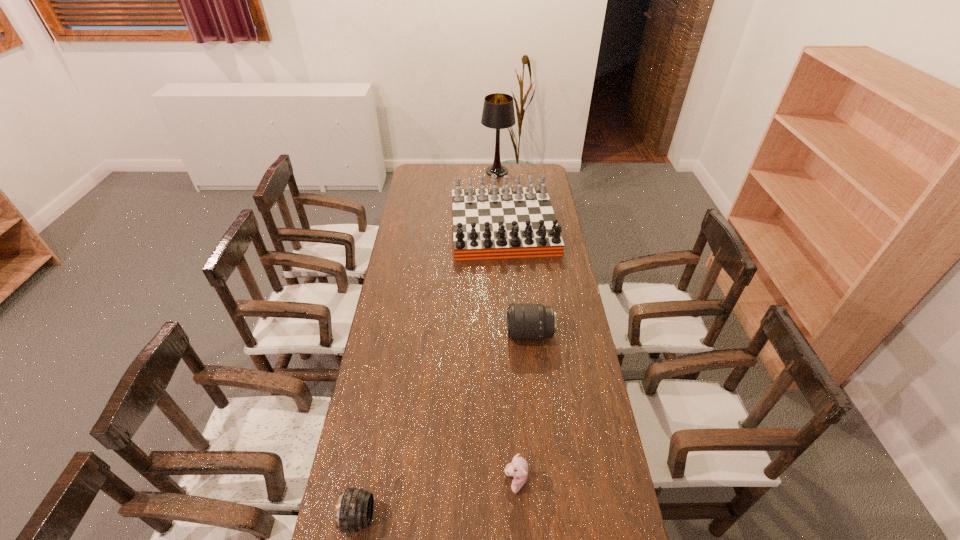
Where is `free location that satisfies the following two spatial constraints: 1. on the front side of the tallest object; 2. on the right side of the gameboard`? free location that satisfies the following two spatial constraints: 1. on the front side of the tallest object; 2. on the right side of the gameboard is located at coordinates (500, 226).